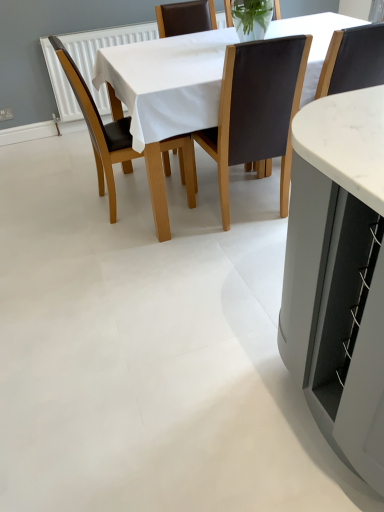
Locate an element on the screen. The image size is (384, 512). vacant space in between brown leather chair at center, arranged as the 3th chair when viewed from the right, and brown leather chair at center, acting as the second chair starting from the right is located at coordinates (194, 214).